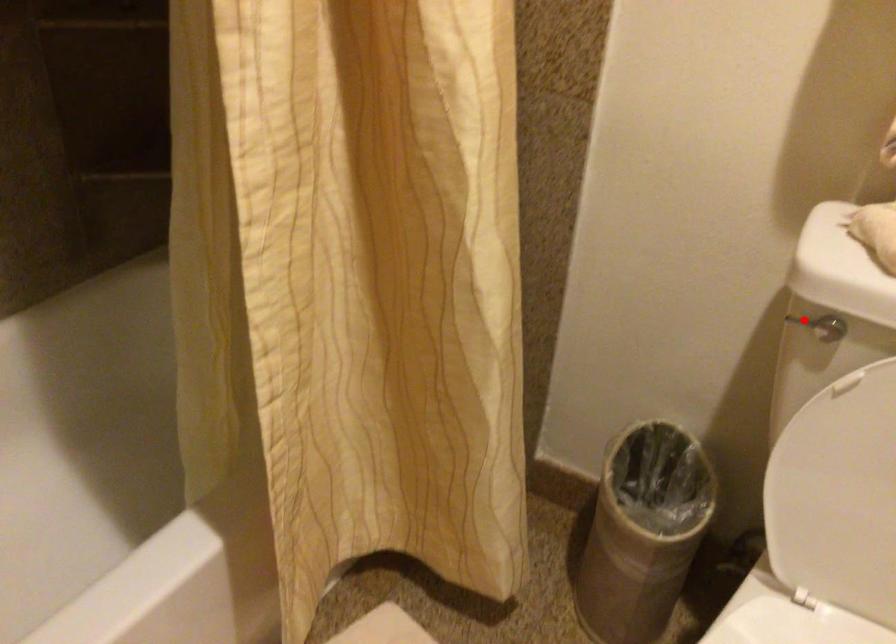
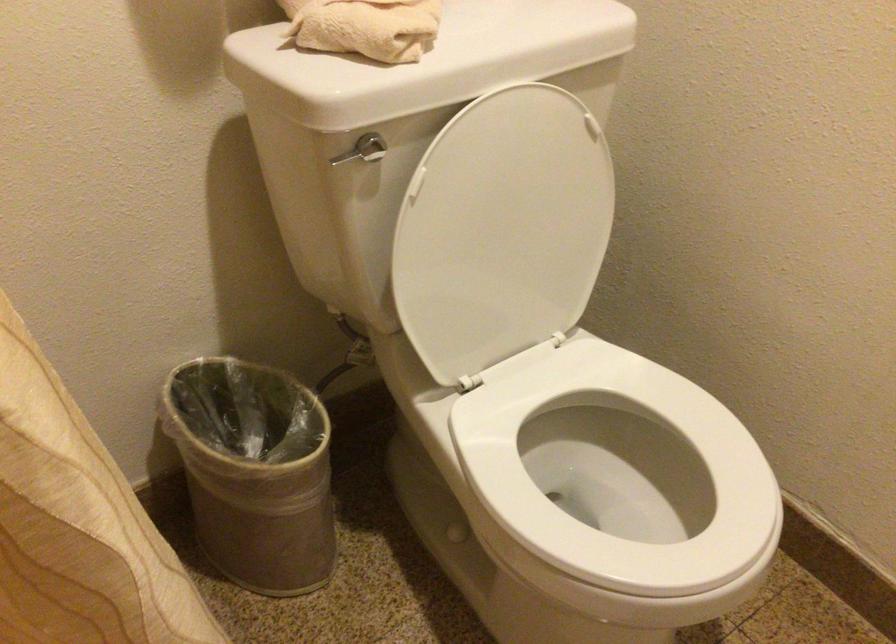
Locate, in the second image, the point that corresponds to the highlighted location in the first image.

(348, 155)